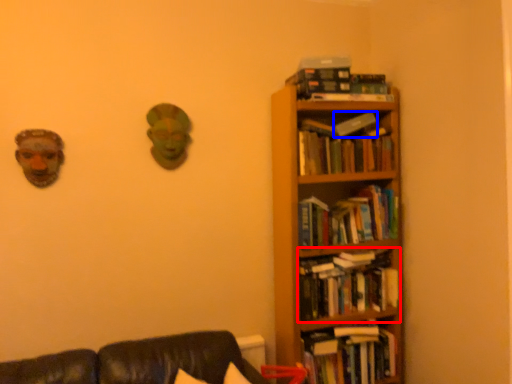
Question: Which point is closer to the camera, book (highlighted by a red box) or paperback book (highlighted by a blue box)?

Choices:
 (A) book
 (B) paperback book

Answer: (A)